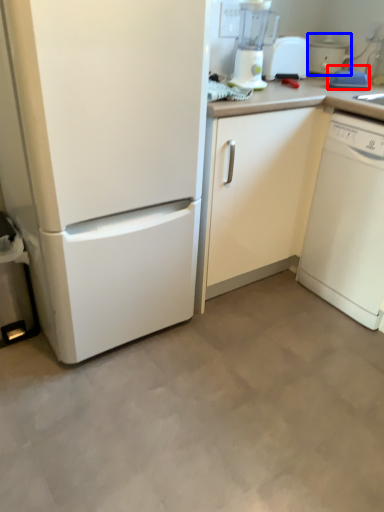
Question: Which of the following is the farthest to the observer, appliance (highlighted by a red box) or cooker (highlighted by a blue box)?

Choices:
 (A) appliance
 (B) cooker

Answer: (B)